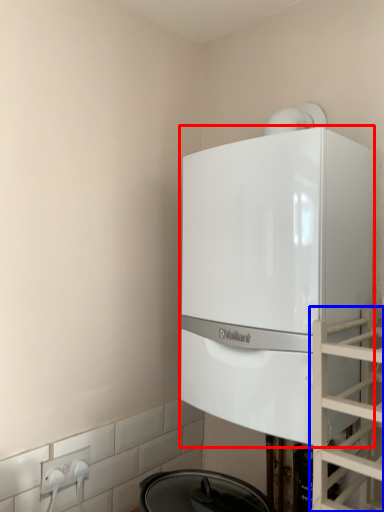
Question: Which point is further to the camera, home appliance (highlighted by a red box) or glass door (highlighted by a blue box)?

Choices:
 (A) home appliance
 (B) glass door

Answer: (A)